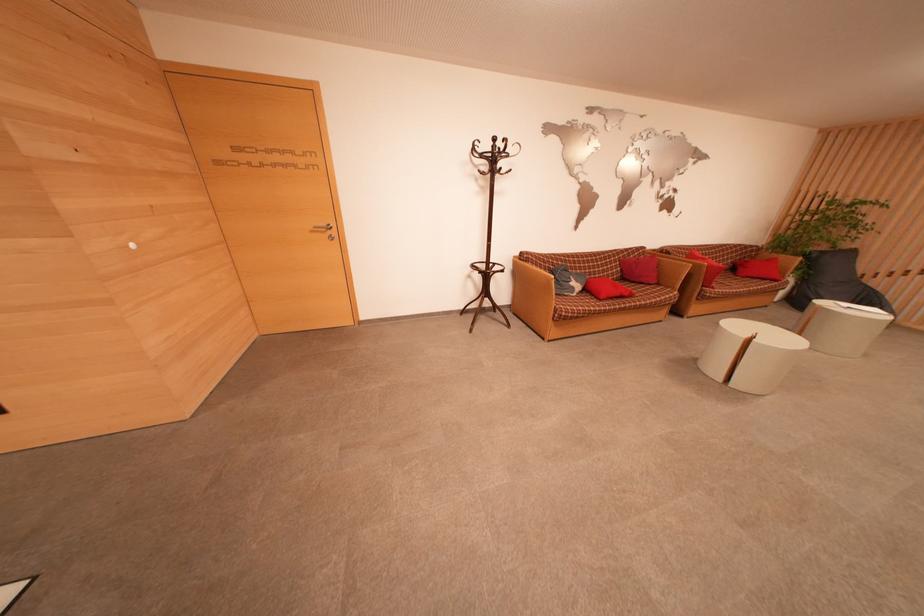
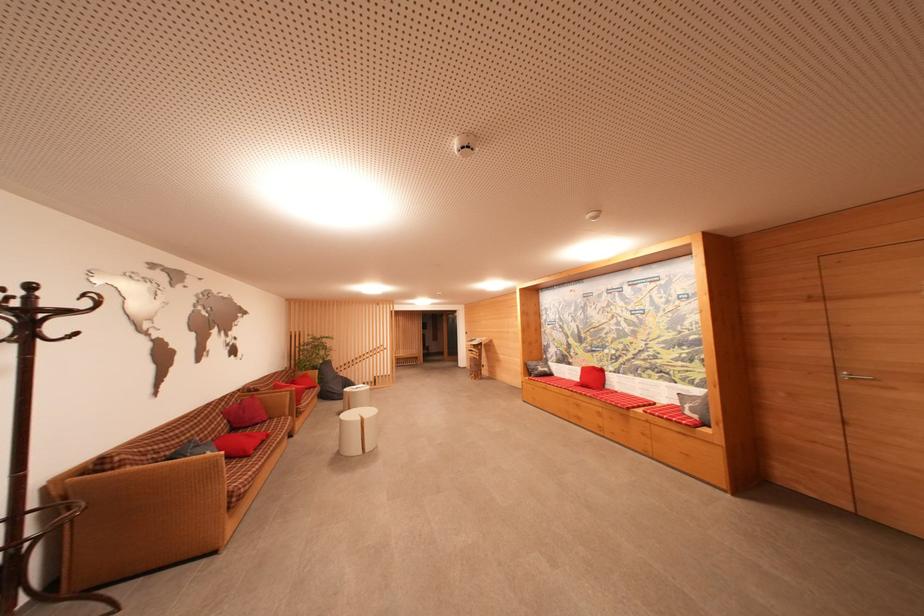
Where in the second image is the point corresponding to (x=775, y=264) from the first image?

(310, 379)